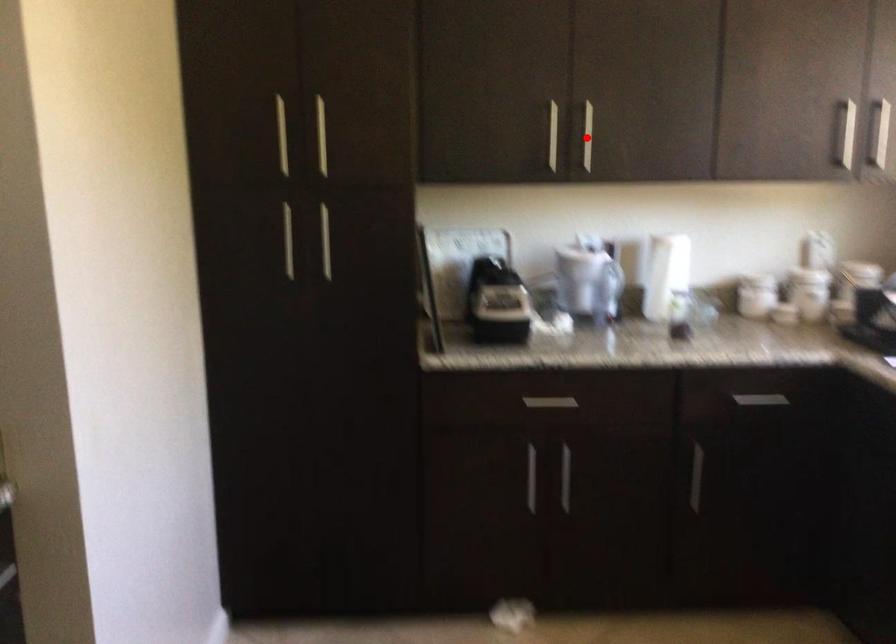
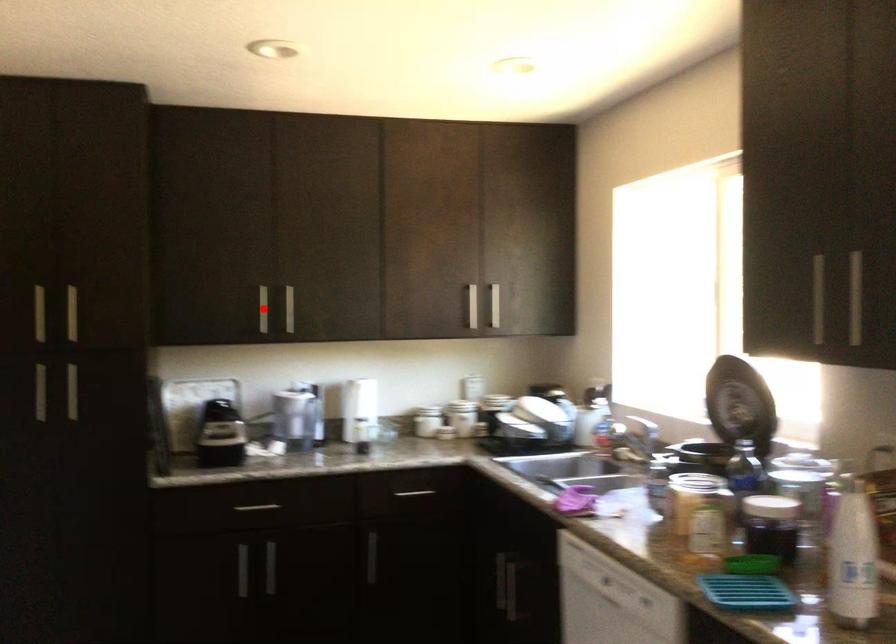
I am providing you with two images of the same scene from different viewpoints. A red point is marked on the first image and another point is marked on the second image. Are the points marked in image1 and image2 representing the same 3D position?

No